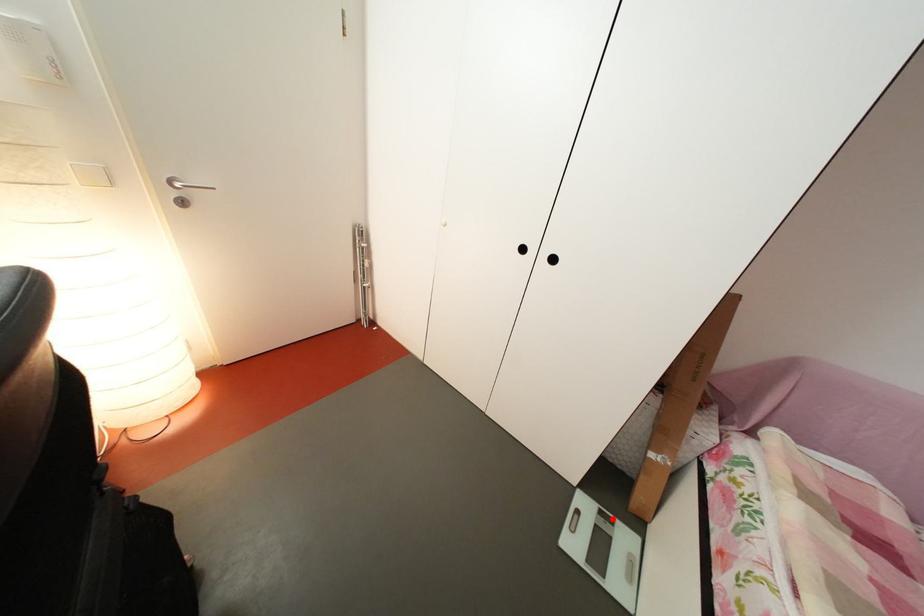
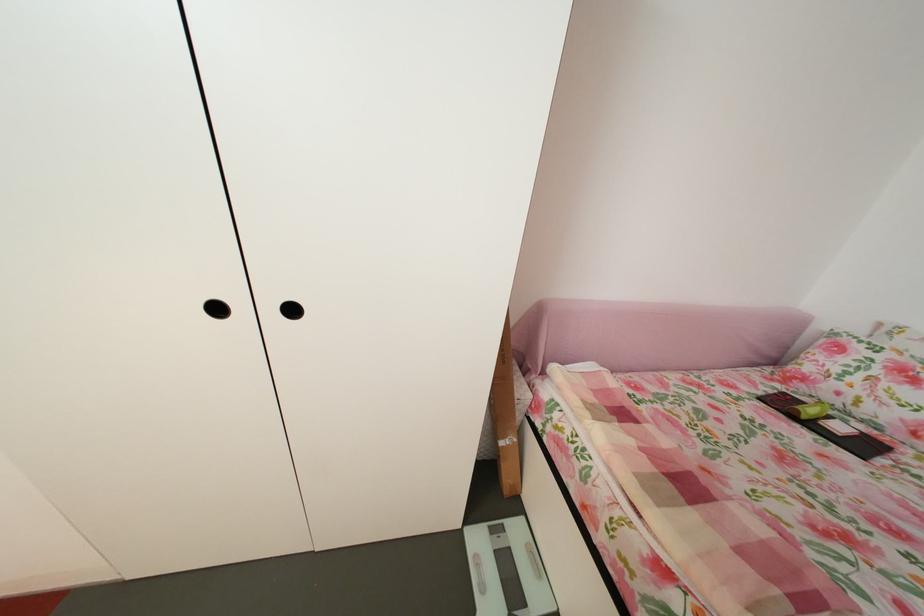
Question: I am providing you with two images of the same scene from different viewpoints. Image1 has a red point marked. In image2, the corresponding 3D location appears at what relative position? Reply with the corresponding letter.

Choices:
 (A) Closer
 (B) Farther

Answer: (B)